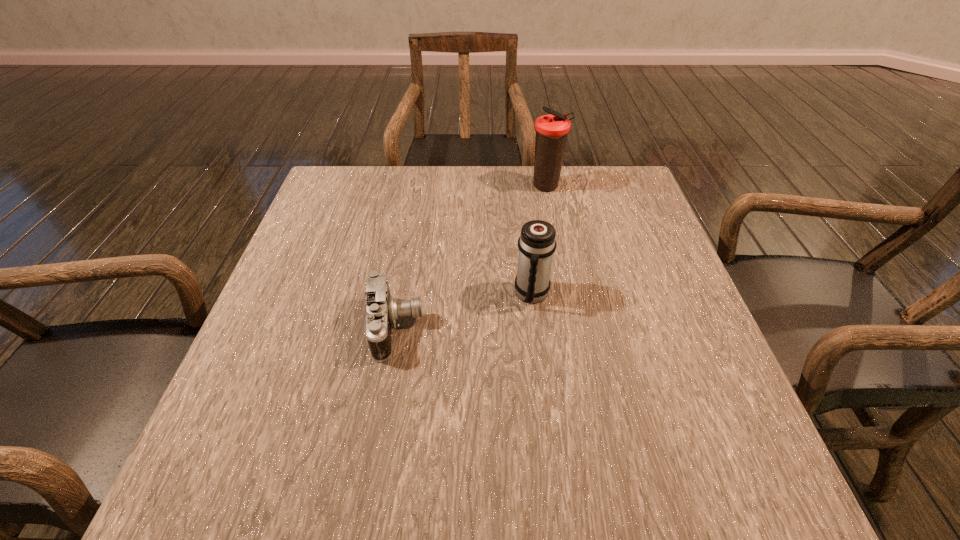
In the image, there is a desktop. Identify the location of free region at the far edge. (418, 171).

What are the coordinates of `vacant space at the near edge` in the screenshot? It's located at (544, 472).

Find the location of `free space at the left edge`. free space at the left edge is located at coordinates (287, 349).

Find the location of `free space at the right edge of the desktop`. free space at the right edge of the desktop is located at coordinates (637, 332).

Locate an element on the screen. vacant space at the far left corner of the desktop is located at coordinates (361, 211).

Find the location of a particular element. This screenshot has width=960, height=540. vacant space at the near left corner is located at coordinates (251, 444).

In the image, there is a desktop. Where is `free space at the far right corner`? This screenshot has width=960, height=540. free space at the far right corner is located at coordinates (627, 208).

This screenshot has width=960, height=540. Identify the location of vacant region at the near right corner. (742, 450).

At what (x,y) coordinates should I click in order to perform the action: click on vacant area that lies between the farther thermos bottle and the shortest object. Please return your answer as a coordinate pair (x, y). Looking at the image, I should click on (471, 257).

The image size is (960, 540). I want to click on free spot between the nearer thermos bottle and the leftmost object, so click(x=464, y=311).